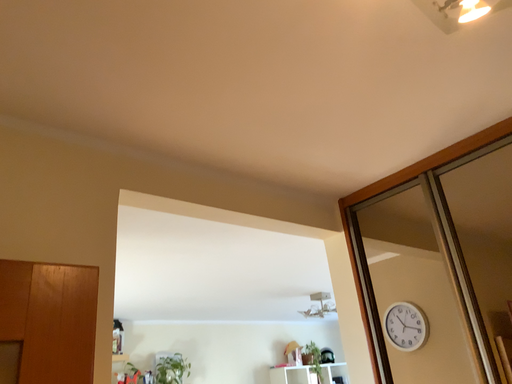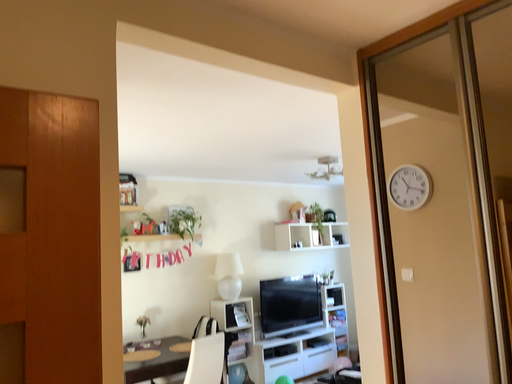
Question: Which way did the camera rotate in the video?

Choices:
 (A) rotated downward
 (B) rotated upward

Answer: (A)